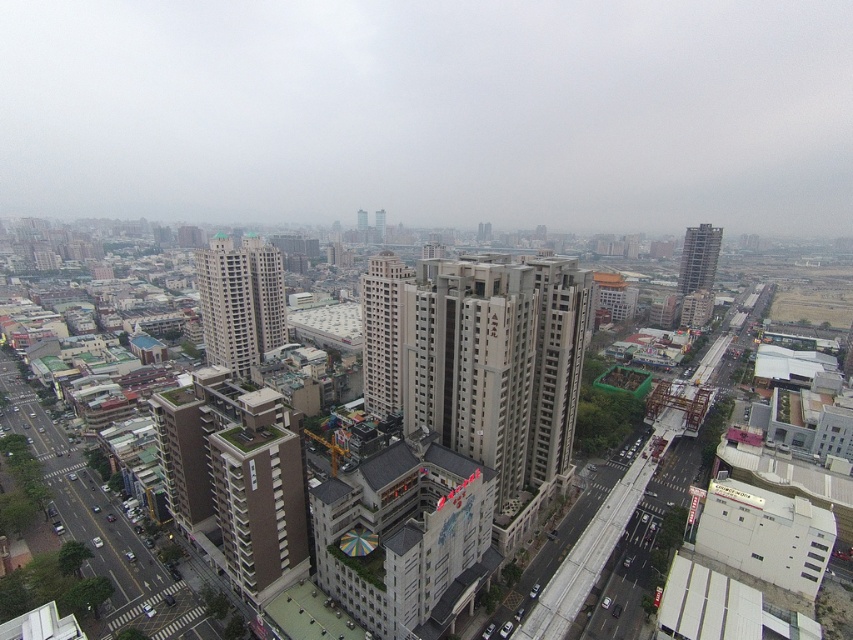
Question: Which object appears closest to the camera in this image?

Choices:
 (A) beige concrete building at center
 (B) gray concrete building at upper right
 (C) beige concrete building at center-left

Answer: (A)

Question: Which is nearer to the gray concrete building at upper right?

Choices:
 (A) beige concrete building at center-left
 (B) beige concrete building at center

Answer: (B)

Question: Does beige concrete building at center appear on the left side of gray concrete building at upper right?

Choices:
 (A) yes
 (B) no

Answer: (A)

Question: Is beige concrete building at center-left closer to camera compared to gray concrete building at upper right?

Choices:
 (A) no
 (B) yes

Answer: (B)

Question: Does beige concrete building at center appear under gray concrete building at upper right?

Choices:
 (A) no
 (B) yes

Answer: (B)

Question: Which object is the farthest from the beige concrete building at center?

Choices:
 (A) beige concrete building at center-left
 (B) gray concrete building at upper right

Answer: (B)